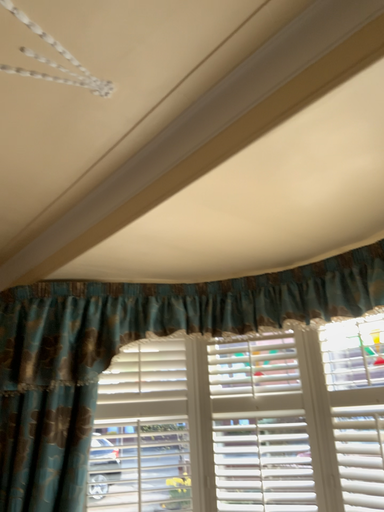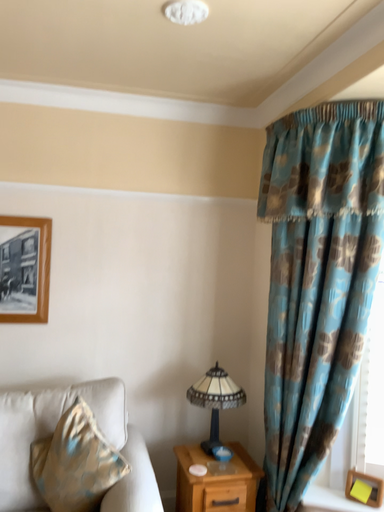
Question: How did the camera likely rotate when shooting the video?

Choices:
 (A) rotated downward
 (B) rotated upward

Answer: (A)